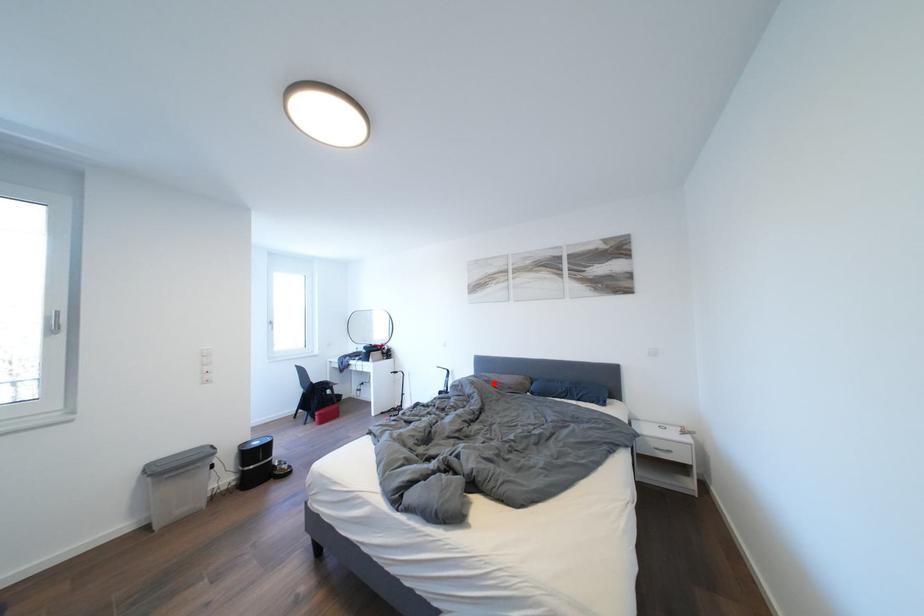
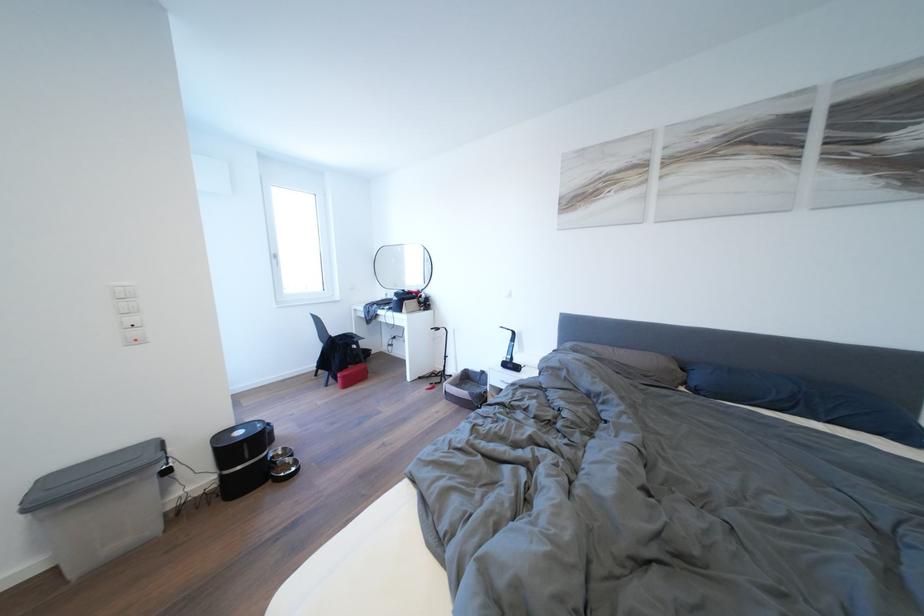
In the second image, find the point that corresponds to the highlighted location in the first image.

(602, 360)